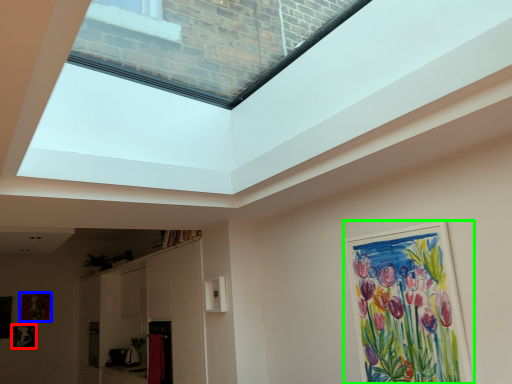
Question: Estimate the real-world distances between objects in this image. Which object is closer to picture frame (highlighted by a red box), picture frame (highlighted by a blue box) or picture frame (highlighted by a green box)?

Choices:
 (A) picture frame
 (B) picture frame

Answer: (A)